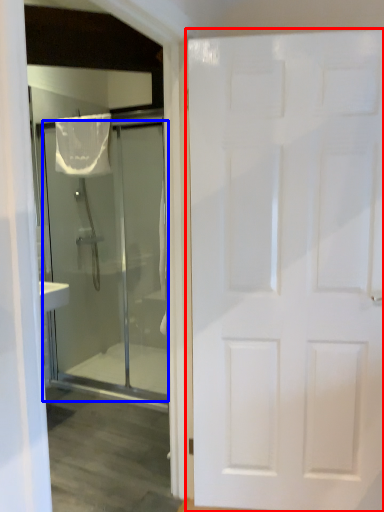
Question: Which point is closer to the camera, door (highlighted by a red box) or door (highlighted by a blue box)?

Choices:
 (A) door
 (B) door

Answer: (A)